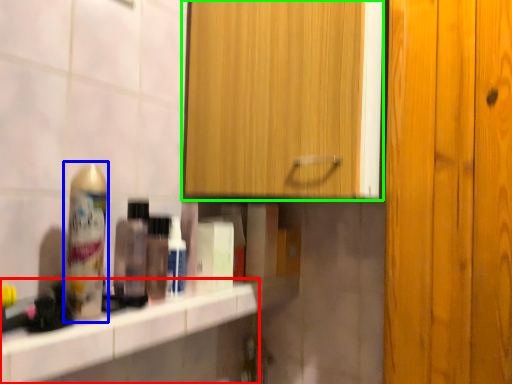
Question: Based on their relative distances, which object is nearer to counter top (highlighted by a red box)? Choose from shaving cream (highlighted by a blue box) and cabinetry (highlighted by a green box).

Choices:
 (A) shaving cream
 (B) cabinetry

Answer: (A)